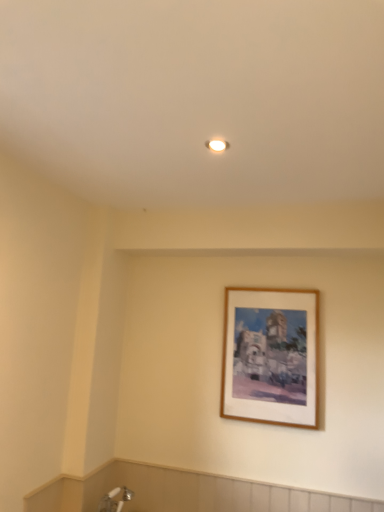
Question: Should I look upward or downward to see wooden picture frame at upper center?

Choices:
 (A) down
 (B) up

Answer: (A)